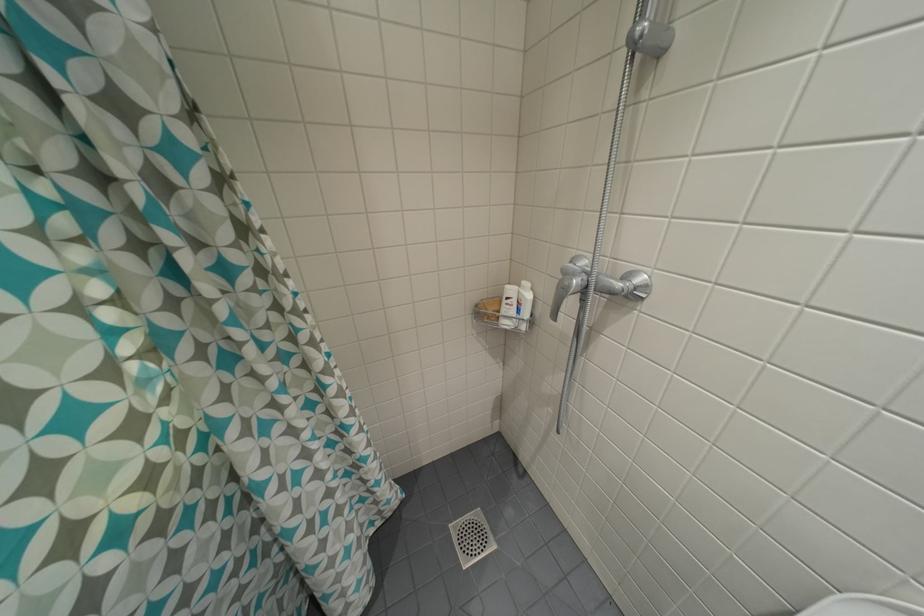
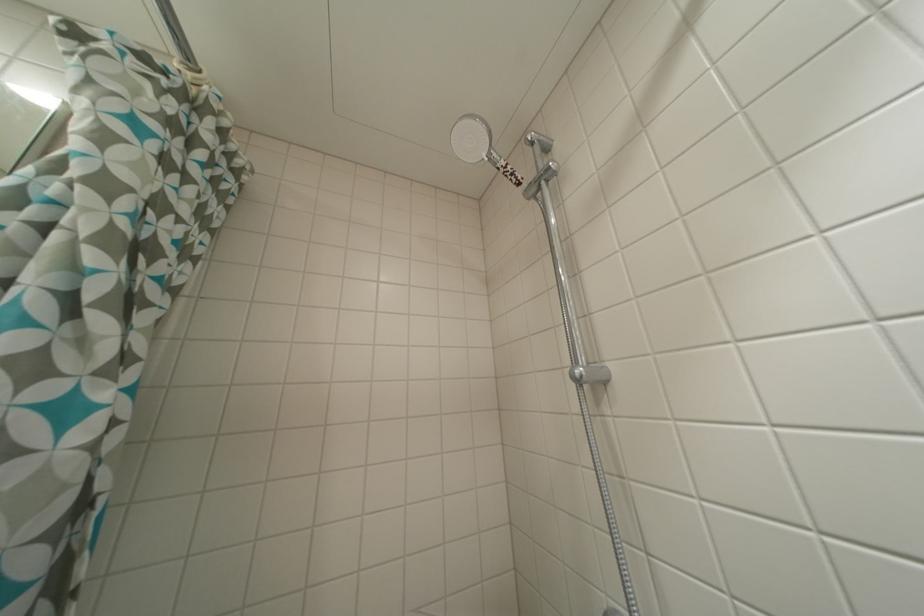
Question: The images are taken continuously from a first-person perspective. In which direction is your viewpoint rotating?

Choices:
 (A) Left
 (B) Right
 (C) Up
 (D) Down

Answer: (C)